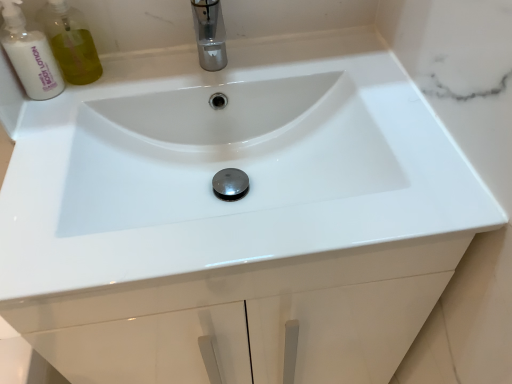
Locate an element on the screen. empty space that is to the right of white lotion at upper left is located at coordinates (125, 78).